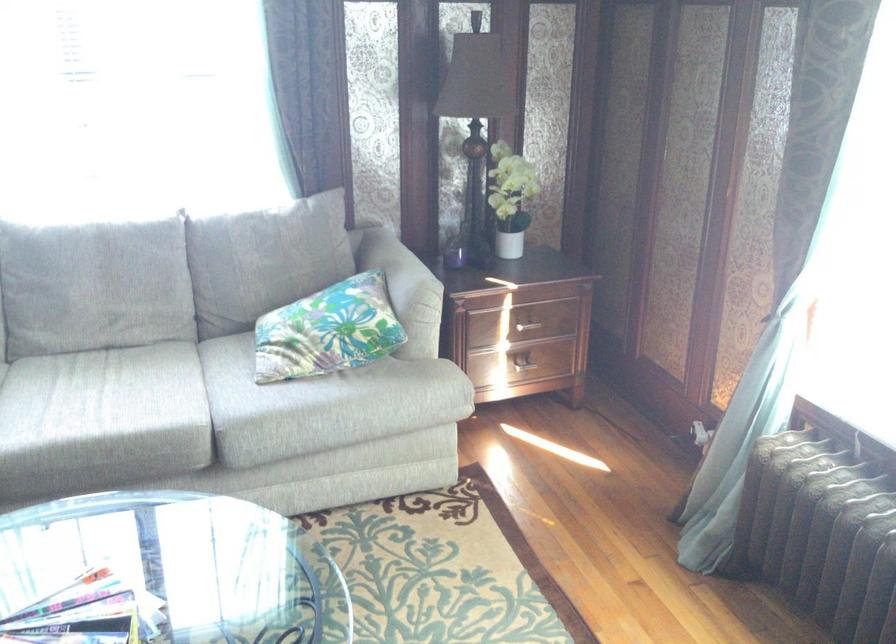
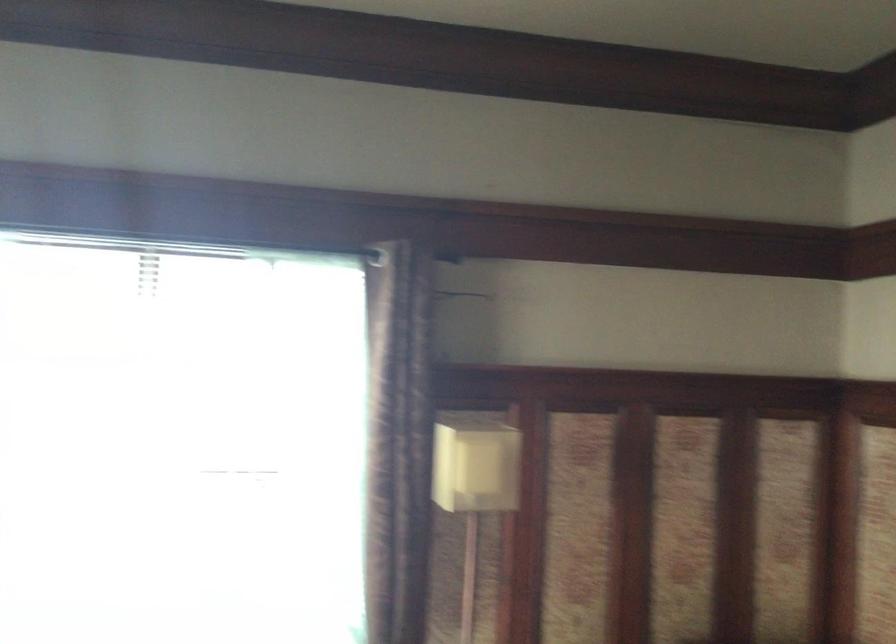
Question: How did the camera likely rotate?

Choices:
 (A) Left
 (B) Right
 (C) Up
 (D) Down

Answer: (B)